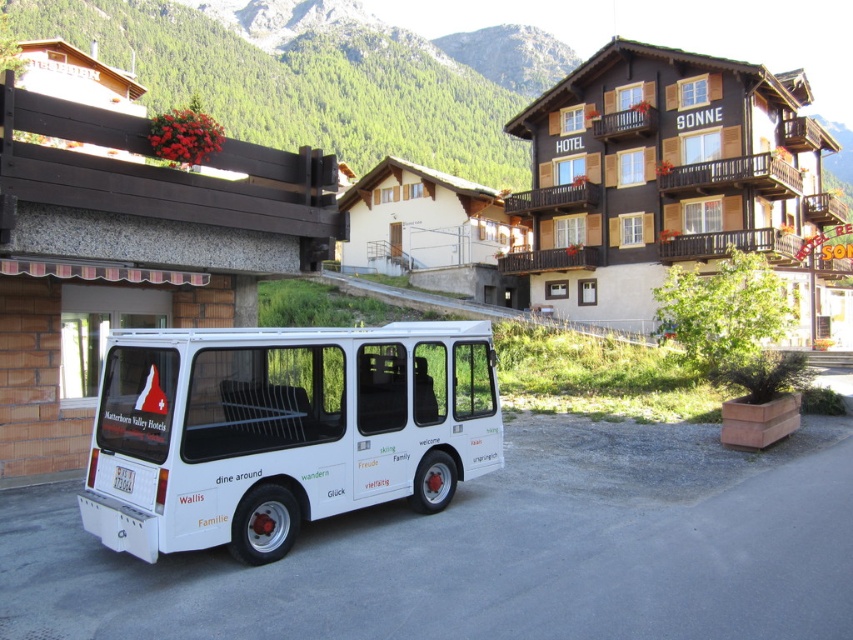
Does brown wooden hotel at upper center lie behind brown wood overpass at upper left?

Yes, it is behind brown wood overpass at upper left.

What are the coordinates of `brown wooden hotel at upper center` in the screenshot? It's located at click(670, 180).

Who is positioned more to the right, white matte van at center or brown wood overpass at upper left?

white matte van at center

Image resolution: width=853 pixels, height=640 pixels. Identify the location of white matte van at center. (282, 429).

Is white matte van at center smaller than brown wooden hotel at upper center?

Yes, white matte van at center is smaller than brown wooden hotel at upper center.

Which is behind, point (469, 401) or point (631, 195)?

Positioned behind is point (631, 195).

This screenshot has width=853, height=640. In order to click on white matte van at center in this screenshot , I will do `click(282, 429)`.